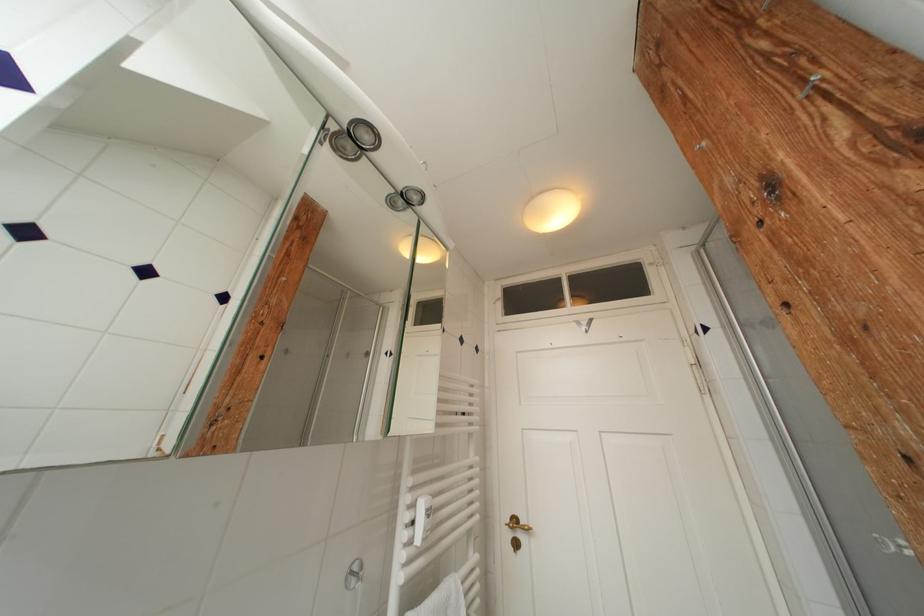
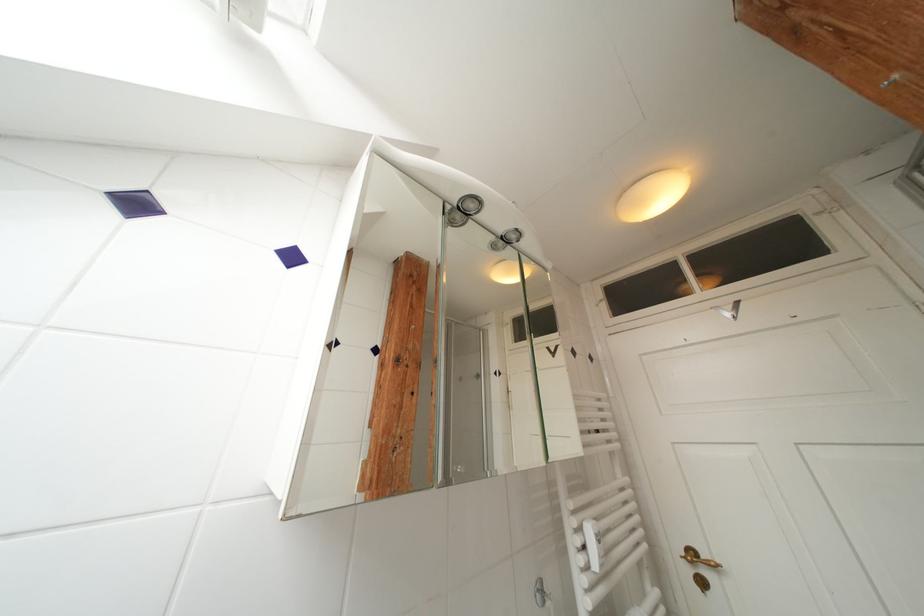
Where in the second image is the point corresponding to pixel 521 525 from the first image?

(699, 557)